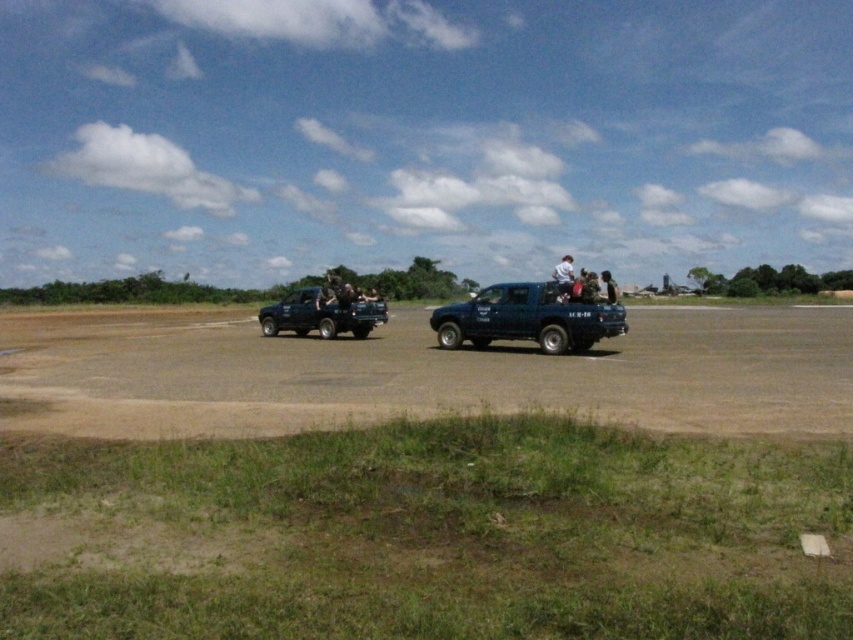
Who is lower down, matte blue truck at center or matte dark green truck at left?

matte blue truck at center is below.

Which of these two, matte blue truck at center or matte dark green truck at left, stands shorter?

Standing shorter between the two is matte dark green truck at left.

Is point (469, 330) in front of point (370, 324)?

Yes, it is in front of point (370, 324).

I want to click on matte blue truck at center, so click(527, 317).

Does matte dark green truck at left have a smaller size compared to white matte shirt at center?

Indeed, matte dark green truck at left has a smaller size compared to white matte shirt at center.

Does matte dark green truck at left appear under white matte shirt at center?

Yes.

What do you see at coordinates (322, 314) in the screenshot?
I see `matte dark green truck at left` at bounding box center [322, 314].

You are a GUI agent. You are given a task and a screenshot of the screen. Output one action in this format:
    pyautogui.click(x=<x>, y=<y>)
    Task: Click on the matte dark green truck at left
    The height and width of the screenshot is (640, 853).
    Given the screenshot: What is the action you would take?
    pyautogui.click(x=322, y=314)

Can you confirm if matte blue truck at center is smaller than white matte shirt at center?

Yes, matte blue truck at center is smaller than white matte shirt at center.

Does matte blue truck at center have a lesser width compared to white matte shirt at center?

Yes.

Image resolution: width=853 pixels, height=640 pixels. Describe the element at coordinates (527, 317) in the screenshot. I see `matte blue truck at center` at that location.

Find the location of a particular element. The width and height of the screenshot is (853, 640). matte blue truck at center is located at coordinates (527, 317).